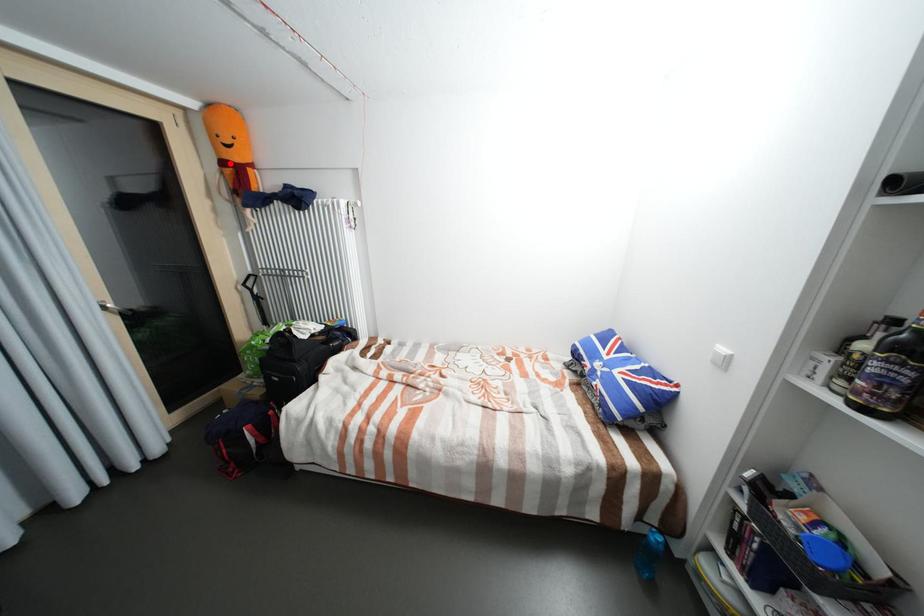
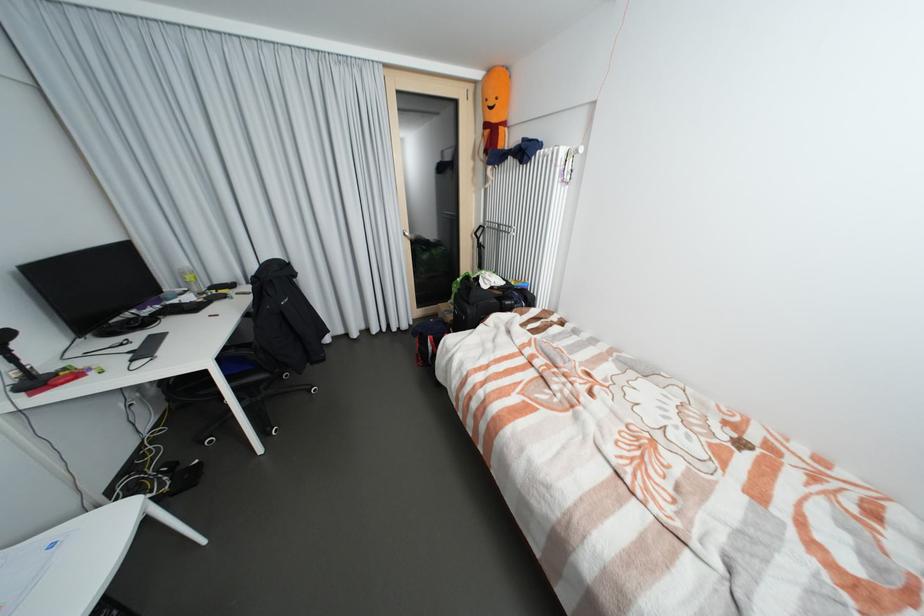
The point at the highlighted location is marked in the first image. Where is the corresponding point in the second image?

(492, 126)